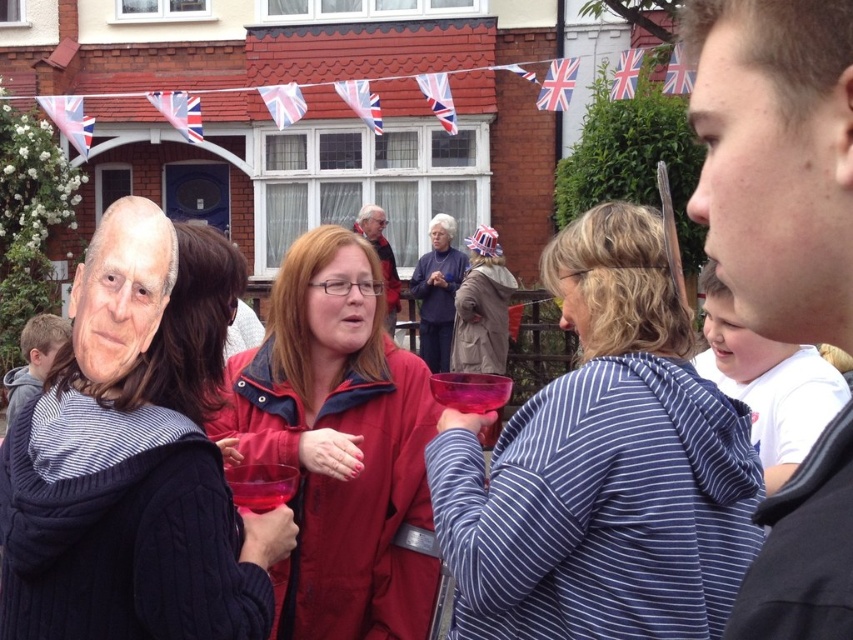
You are a photographer at the event and want to ensure both the matte black sweater at center and the smooth skin face at center are clearly visible in your photo. Which object should you focus on first to ensure proper framing?

The smooth skin face at center should be focused on first because the matte black sweater at center is not as tall as the smooth skin face at center, meaning the face is taller and more prominent in the frame.

From the picture: You are a photographer at the event and want to take a group photo of the smooth skin face at center and the matte blue sweater at center. When arranging them, which object should be placed to the left to ensure they are aligned with the Union Jack flags in the background?

The matte blue sweater at center should be placed to the left because the smooth skin face at center is positioned on the right side of the matte blue sweater at center, so placing the matte blue sweater at center on the left will keep them aligned with the flags.

You are a photographer at this event and want to capture both the striped cotton hoodie at center and the smooth skin face at center in a single photo. Which object should you focus on first to ensure both are in frame?

You should focus on the striped cotton hoodie at center first because it is smaller than the smooth skin face at center, so adjusting the frame to include the smaller object ensures the larger one will also be captured.